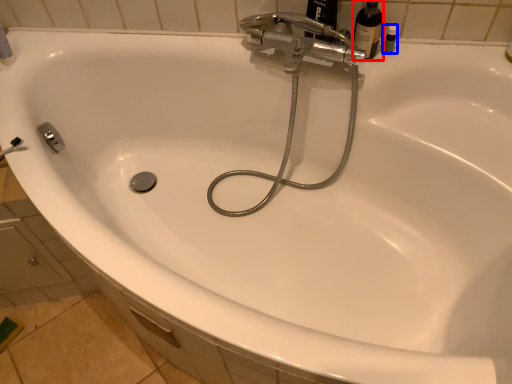
Question: Which object appears farthest to the camera in this image, bottle (highlighted by a red box) or toiletry (highlighted by a blue box)?

Choices:
 (A) bottle
 (B) toiletry

Answer: (B)